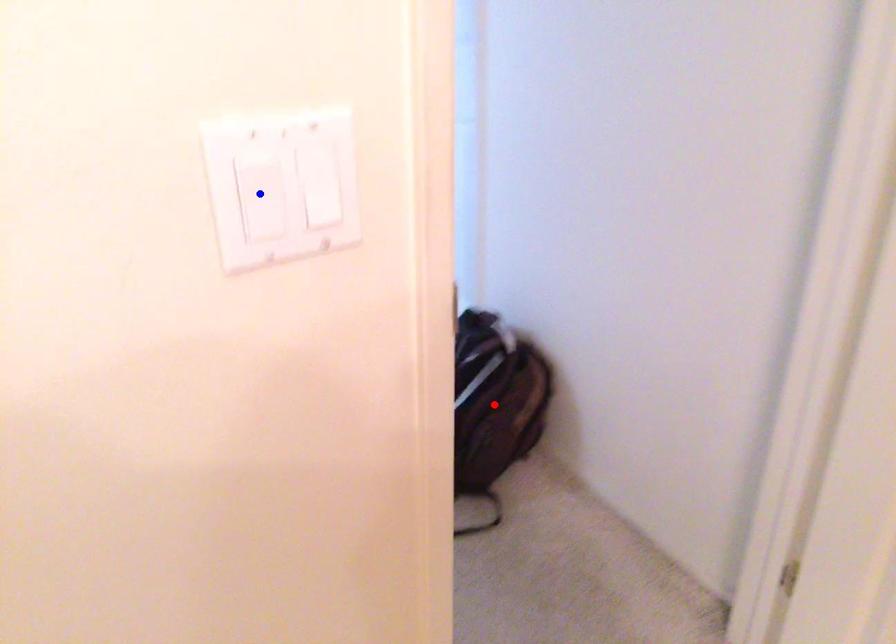
Question: Two points are marked on the image. Which point is closer to the camera?

Choices:
 (A) Blue point is closer.
 (B) Red point is closer.

Answer: (A)